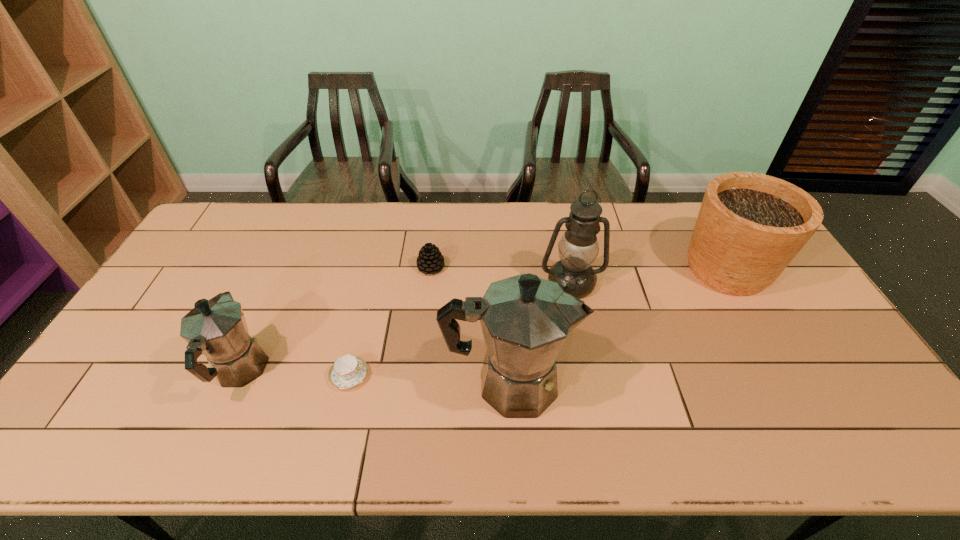
Where is `vacant space situated 0.250m on the pouring side of the left coffeepot`? The image size is (960, 540). vacant space situated 0.250m on the pouring side of the left coffeepot is located at coordinates (283, 274).

You are a GUI agent. You are given a task and a screenshot of the screen. Output one action in this format:
    pyautogui.click(x=<x>, y=<y>)
    Task: Click on the free space located on the pouring side of the left coffeepot
    The image size is (960, 540).
    Given the screenshot: What is the action you would take?
    pyautogui.click(x=296, y=247)

Locate an element on the screen. free spot located on the pouring side of the taller coffeepot is located at coordinates (642, 383).

I want to click on free region located 0.100m at the narrow end of the fourth object from right to left, so click(476, 267).

Locate an element on the screen. vacant area located 0.150m on the left of the flowerpot is located at coordinates (634, 269).

Where is `vacant space located on the side with the handle of the shortest object`? vacant space located on the side with the handle of the shortest object is located at coordinates click(x=501, y=376).

Identify the location of vacant region located 0.080m on the front of the oil lamp. The width and height of the screenshot is (960, 540). (579, 321).

I want to click on object present at the far edge, so click(x=750, y=226).

At what (x,y) coordinates should I click in order to perform the action: click on teacup that is at the near edge. Please return your answer as a coordinate pair (x, y). Image resolution: width=960 pixels, height=540 pixels. Looking at the image, I should click on (348, 371).

This screenshot has height=540, width=960. Identify the location of object that is positioned at the right edge. (750, 226).